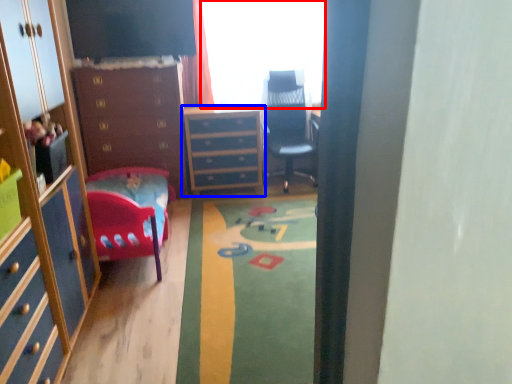
Question: Which object appears closest to the camera in this image, window (highlighted by a red box) or chest of drawers (highlighted by a blue box)?

Choices:
 (A) window
 (B) chest of drawers

Answer: (A)